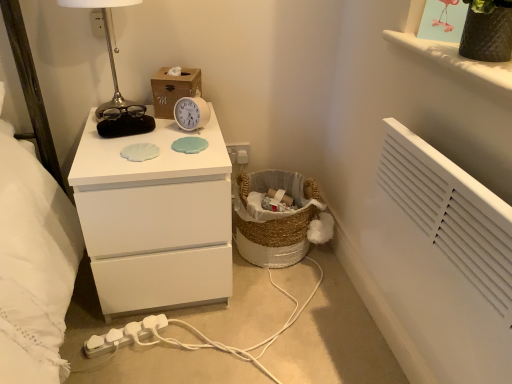
Where is `vacant space in front of metallic silver table lamp at upper left`? vacant space in front of metallic silver table lamp at upper left is located at coordinates (112, 151).